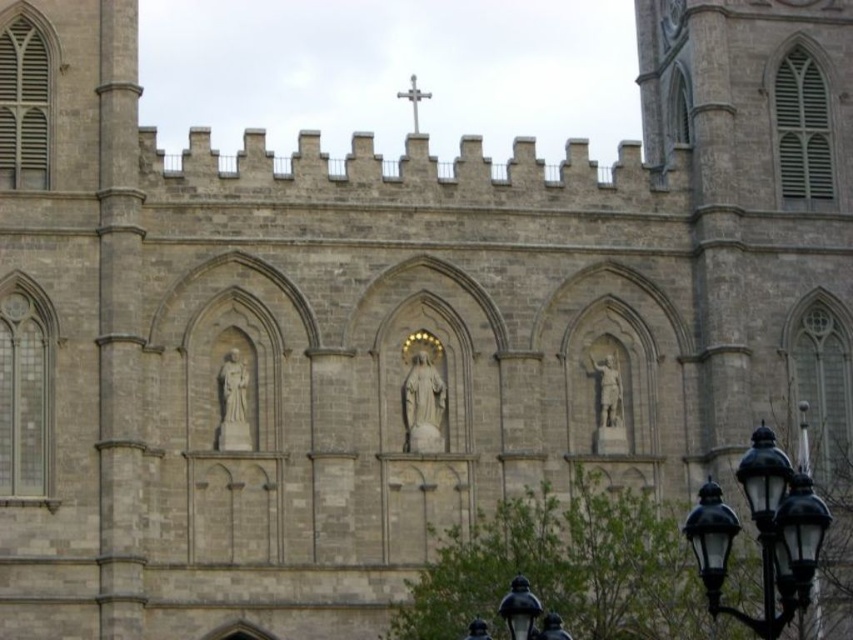
Is black glass streetlight at lower right positioned before silver metallic cross at upper center?

Yes.

Does point (793, 557) come farther from viewer compared to point (399, 92)?

That is False.

Where is `black glass streetlight at lower right`? The height and width of the screenshot is (640, 853). black glass streetlight at lower right is located at coordinates (762, 532).

Is point (469, 627) in front of point (422, 92)?

Yes.

Can you confirm if black glass lamp post at lower right is smaller than silver metallic cross at upper center?

No, black glass lamp post at lower right is not smaller than silver metallic cross at upper center.

Identify the location of black glass lamp post at lower right. Image resolution: width=853 pixels, height=640 pixels. tap(527, 612).

At what (x,y) coordinates should I click in order to perform the action: click on black glass lamp post at lower right. Please return your answer as a coordinate pair (x, y). Looking at the image, I should click on (527, 612).

Can you confirm if black glass streetlight at lower right is shorter than black glass lamp post at lower right?

No.

Which is behind, point (785, 460) or point (476, 627)?

The point (476, 627) is more distant.

This screenshot has width=853, height=640. Find the location of `black glass streetlight at lower right`. black glass streetlight at lower right is located at coordinates (762, 532).